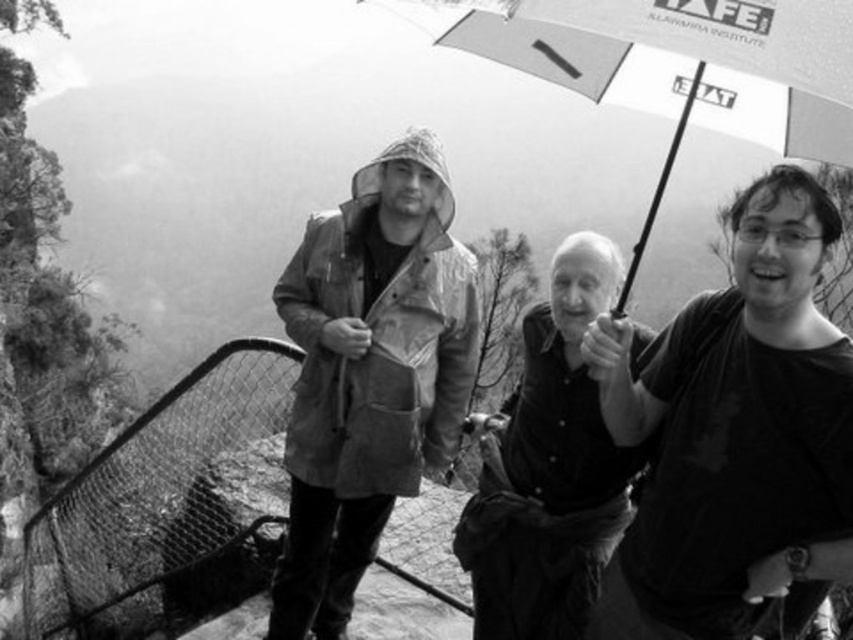
Question: Which is farther from the black matte t-shirt at right?

Choices:
 (A) white fabric umbrella at center
 (B) metal mesh rope bridge at center

Answer: (B)

Question: Which point is closer to the camera taking this photo?

Choices:
 (A) (689, 353)
 (B) (556, 284)

Answer: (A)

Question: Can you confirm if black matte t-shirt at right is positioned to the right of waterproof fabric jacket at center?

Choices:
 (A) yes
 (B) no

Answer: (A)

Question: Is the position of black matte t-shirt at right more distant than that of smooth black shirt at center?

Choices:
 (A) yes
 (B) no

Answer: (B)

Question: Which object appears closest to the camera in this image?

Choices:
 (A) metal mesh rope bridge at center
 (B) white fabric umbrella at center
 (C) black matte t-shirt at right
 (D) smooth black shirt at center

Answer: (B)

Question: Does black matte t-shirt at right have a smaller size compared to smooth black shirt at center?

Choices:
 (A) no
 (B) yes

Answer: (B)